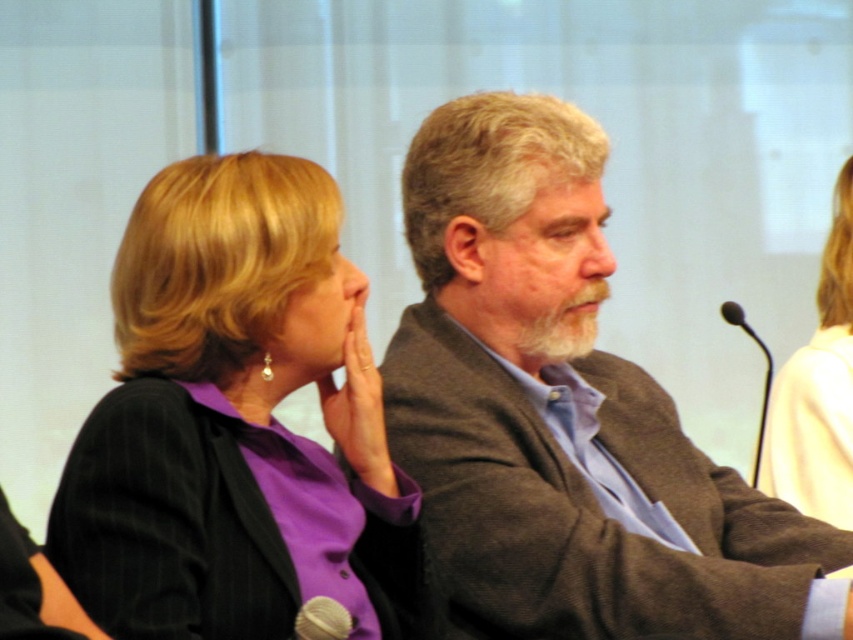
You are a sound technician in a meeting room. You need to adjust the microphone located at point (322, 620). To do this, you must first determine its position relative to the two people in the image. Which person is closer to the silver metallic microphone at lower left?

The silver metallic microphone at lower left is located at point (322, 620). Since the microphone is at the lower left, it is closer to the woman on the left who is seated there. Therefore, the woman on the left is closer to the silver metallic microphone at lower left.

You are standing in front of a large screen and see the point at coordinates [120,467]. If you want to touch this point with a 1.5 meter long stick, will the stick reach it?

The distance of point [120,467] from viewer is 1.24 meters. Since the stick is 1.5 meters long, it can reach the point.